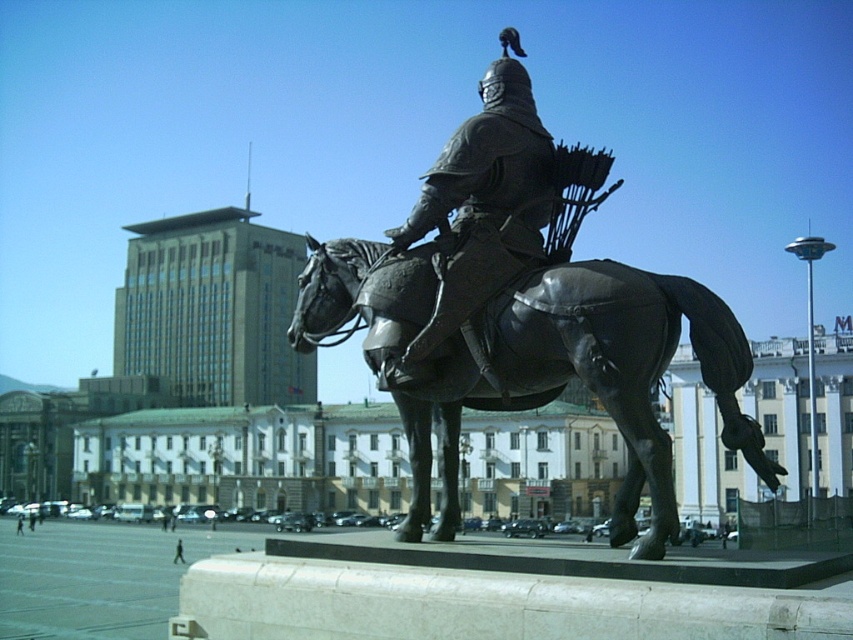
You are standing in the public square where the equestrian statue is located. You want to place a new bench at the point labeled point [645,337]. If the bench is 6 feet long, will it fit in the space between the statue and the modern highrise building to the left?

The distance between you and the point labeled point [645,337] is 41.97 feet. Since the bench is only 6 feet long, there is ample space to place it between the statue and the modern highrise building to the left.